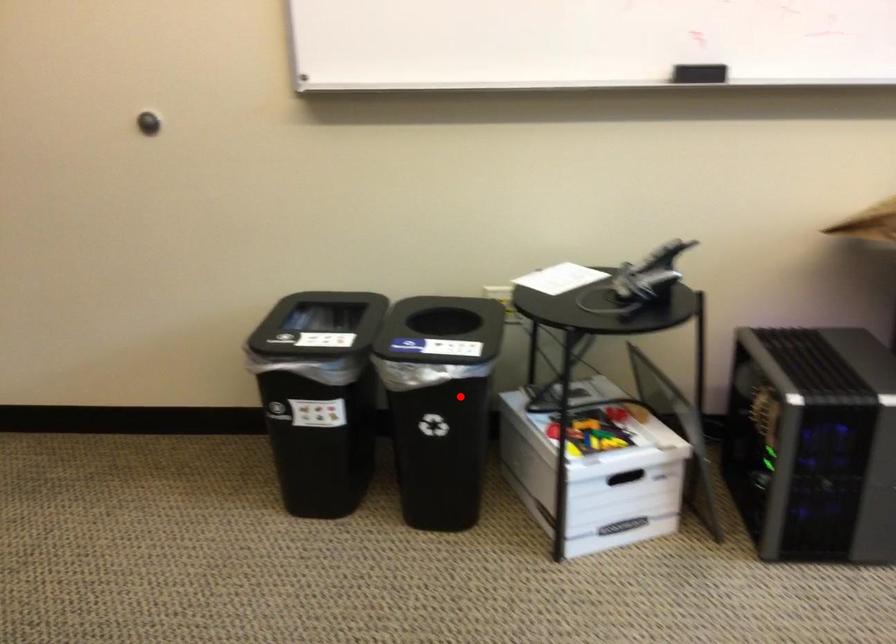
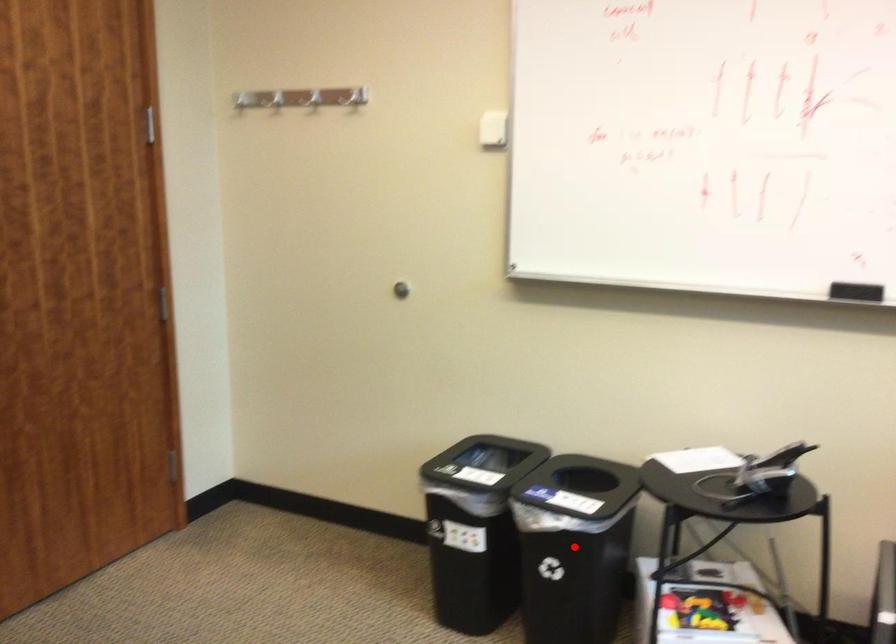
I am providing you with two images of the same scene from different viewpoints. A red point is marked on the first image and another point is marked on the second image. Do the highlighted points in image1 and image2 indicate the same real-world spot?

Yes